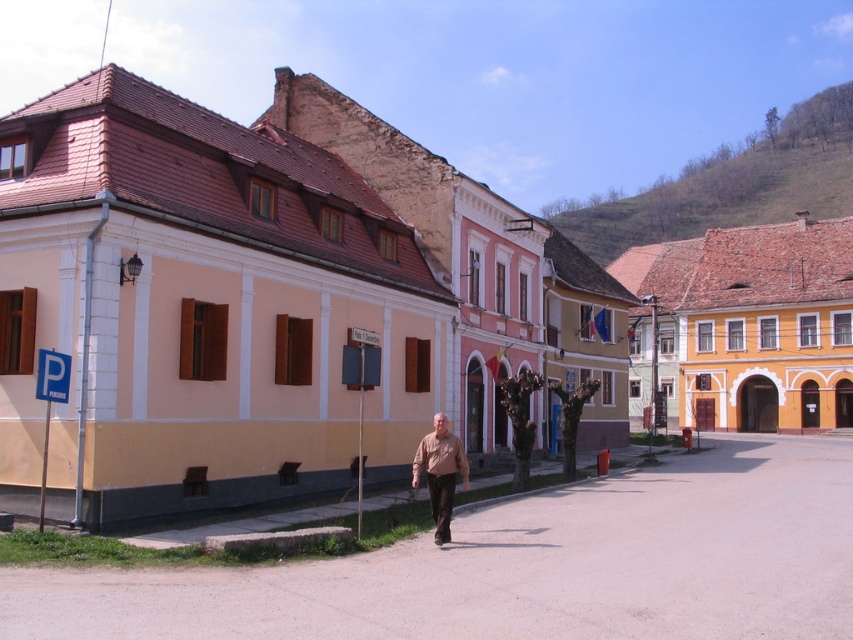
Who is more distant from viewer, (311, 365) or (445, 534)?

The point (311, 365) is behind.

You are a GUI agent. You are given a task and a screenshot of the screen. Output one action in this format:
    pyautogui.click(x=<x>, y=<y>)
    Task: Click on the matte pink building at center
    The height and width of the screenshot is (640, 853).
    Given the screenshot: What is the action you would take?
    pyautogui.click(x=258, y=298)

Where is `matte pink building at center`? This screenshot has width=853, height=640. matte pink building at center is located at coordinates (258, 298).